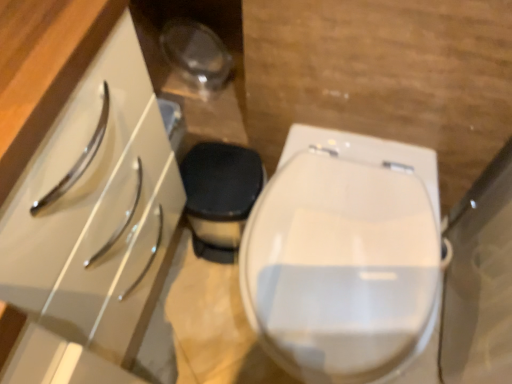
Question: Is white glossy toilet at center located within white glossy cabinet at left?

Choices:
 (A) yes
 (B) no

Answer: (B)

Question: Can you confirm if white glossy cabinet at left is shorter than white glossy toilet at center?

Choices:
 (A) no
 (B) yes

Answer: (A)

Question: Does white glossy cabinet at left lie in front of white glossy toilet at center?

Choices:
 (A) no
 (B) yes

Answer: (B)

Question: From the image's perspective, is white glossy cabinet at left beneath white glossy toilet at center?

Choices:
 (A) yes
 (B) no

Answer: (B)

Question: Does white glossy cabinet at left appear on the left side of white glossy toilet at center?

Choices:
 (A) no
 (B) yes

Answer: (B)

Question: Could you tell me if white glossy cabinet at left is turned towards white glossy toilet at center?

Choices:
 (A) no
 (B) yes

Answer: (B)

Question: Is white glossy toilet at center wider than white glossy cabinet at left?

Choices:
 (A) no
 (B) yes

Answer: (B)

Question: From a real-world perspective, is white glossy toilet at center located beneath white glossy cabinet at left?

Choices:
 (A) yes
 (B) no

Answer: (A)

Question: Can you confirm if white glossy toilet at center is positioned to the right of white glossy cabinet at left?

Choices:
 (A) yes
 (B) no

Answer: (A)

Question: From a real-world perspective, is white glossy toilet at center positioned over white glossy cabinet at left based on gravity?

Choices:
 (A) no
 (B) yes

Answer: (A)

Question: Can we say white glossy toilet at center lies outside white glossy cabinet at left?

Choices:
 (A) yes
 (B) no

Answer: (A)

Question: Is white glossy toilet at center directly adjacent to white glossy cabinet at left?

Choices:
 (A) no
 (B) yes

Answer: (A)

Question: Is white glossy toilet at center in front of or behind white glossy cabinet at left in the image?

Choices:
 (A) behind
 (B) front

Answer: (A)